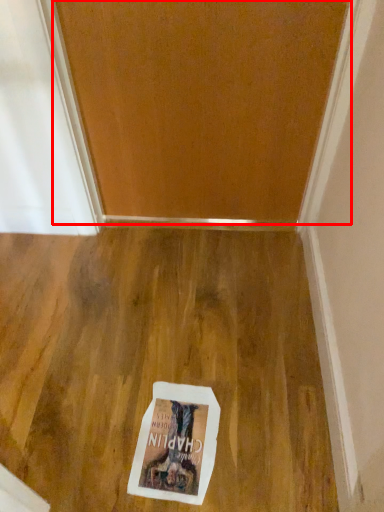
Question: From the image's perspective, what is the correct spatial positioning of door (annotated by the red box) in reference to postcard?

Choices:
 (A) above
 (B) below

Answer: (A)